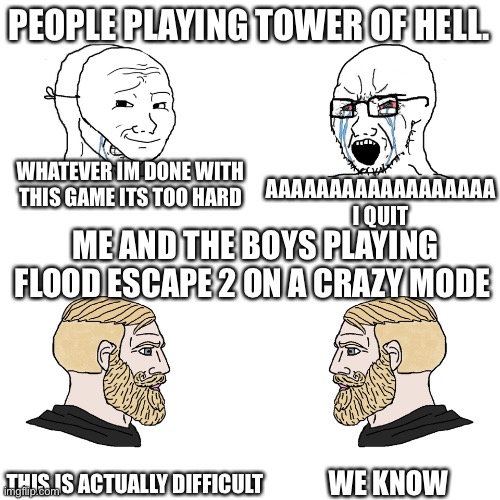
This screenshot has height=500, width=500. What are the coordinates of `poster` in the screenshot? It's located at (260, 149).